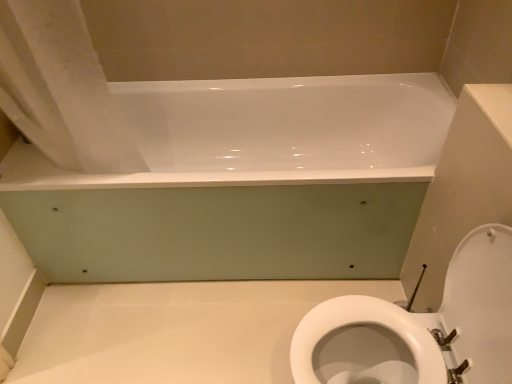
Question: Would you say white fabric shower curtain at upper left is part of white glossy toilet at lower right's contents?

Choices:
 (A) yes
 (B) no

Answer: (B)

Question: From the image's perspective, is white glossy toilet at lower right located beneath white fabric shower curtain at upper left?

Choices:
 (A) no
 (B) yes

Answer: (B)

Question: Is white glossy toilet at lower right beside white fabric shower curtain at upper left?

Choices:
 (A) no
 (B) yes

Answer: (A)

Question: Is white glossy toilet at lower right to the left of white fabric shower curtain at upper left from the viewer's perspective?

Choices:
 (A) yes
 (B) no

Answer: (B)

Question: From a real-world perspective, does white glossy toilet at lower right sit lower than white fabric shower curtain at upper left?

Choices:
 (A) no
 (B) yes

Answer: (B)

Question: From the image's perspective, relative to white glossy bathtub at upper center, is white fabric shower curtain at upper left above or below?

Choices:
 (A) above
 (B) below

Answer: (A)

Question: Looking at the image, does white fabric shower curtain at upper left seem bigger or smaller compared to white glossy bathtub at upper center?

Choices:
 (A) big
 (B) small

Answer: (B)

Question: Does point (49, 57) appear closer or farther from the camera than point (260, 183)?

Choices:
 (A) closer
 (B) farther

Answer: (A)

Question: From their relative heights in the image, would you say white fabric shower curtain at upper left is taller or shorter than white glossy bathtub at upper center?

Choices:
 (A) short
 (B) tall

Answer: (B)

Question: Based on their sizes in the image, would you say white glossy bathtub at upper center is bigger or smaller than white glossy toilet at lower right?

Choices:
 (A) big
 (B) small

Answer: (A)

Question: Is white glossy bathtub at upper center inside the boundaries of white glossy toilet at lower right, or outside?

Choices:
 (A) inside
 (B) outside

Answer: (B)

Question: From their relative heights in the image, would you say white glossy bathtub at upper center is taller or shorter than white glossy toilet at lower right?

Choices:
 (A) short
 (B) tall

Answer: (A)

Question: In terms of width, does white glossy bathtub at upper center look wider or thinner when compared to white glossy toilet at lower right?

Choices:
 (A) wide
 (B) thin

Answer: (A)

Question: From the image's perspective, is white glossy bathtub at upper center above or below white fabric shower curtain at upper left?

Choices:
 (A) below
 (B) above

Answer: (A)

Question: Looking at the image, does white glossy bathtub at upper center seem bigger or smaller compared to white fabric shower curtain at upper left?

Choices:
 (A) big
 (B) small

Answer: (A)